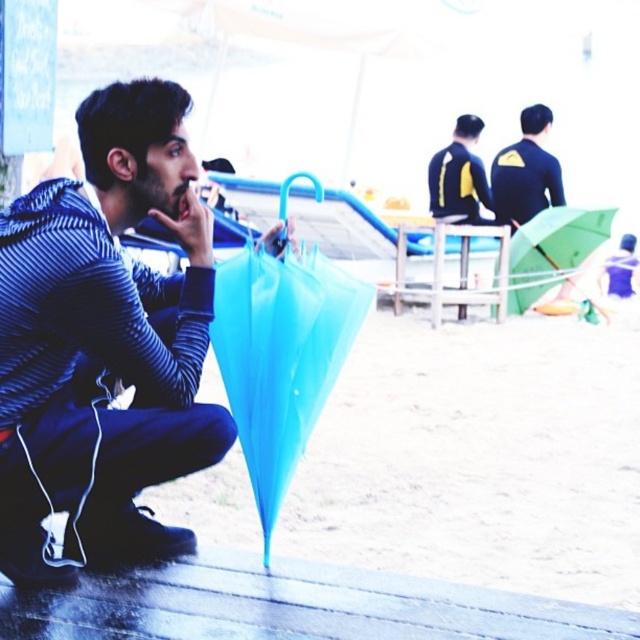
Question: Which of the following is the farthest from the observer?

Choices:
 (A) matte black wetsuit at upper right
 (B) translucent plastic umbrella at lower center

Answer: (A)

Question: Is striped hoodie at center in front of yellow matte wetsuit at upper center?

Choices:
 (A) no
 (B) yes

Answer: (B)

Question: Which of the following is the closest to the observer?

Choices:
 (A) yellow matte wetsuit at upper center
 (B) striped hoodie at center
 (C) translucent plastic umbrella at lower center

Answer: (B)

Question: Is striped hoodie at center smaller than translucent plastic umbrella at lower center?

Choices:
 (A) no
 (B) yes

Answer: (A)

Question: Does striped hoodie at center lie behind green matte umbrella at upper right?

Choices:
 (A) no
 (B) yes

Answer: (A)

Question: Estimate the real-world distances between objects in this image. Which object is farther from the yellow matte wetsuit at upper center?

Choices:
 (A) translucent plastic umbrella at lower center
 (B) striped hoodie at center
 (C) matte black wetsuit at upper right

Answer: (B)